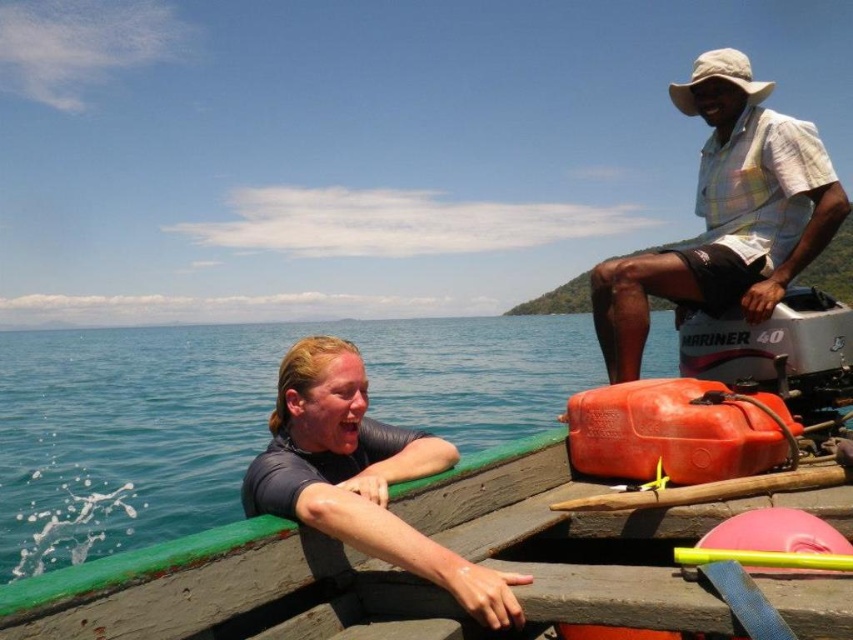
Question: Is the position of white checkered shirt at upper right more distant than that of dark gray wetsuit at left?

Choices:
 (A) no
 (B) yes

Answer: (B)

Question: Which object is positioned closest to the dark gray wetsuit at left?

Choices:
 (A) green wood boat at center
 (B) white checkered shirt at upper right

Answer: (A)

Question: Is white checkered shirt at upper right closer to camera compared to dark gray wetsuit at left?

Choices:
 (A) yes
 (B) no

Answer: (B)

Question: Estimate the real-world distances between objects in this image. Which object is closer to the green wood boat at center?

Choices:
 (A) white checkered shirt at upper right
 (B) dark gray wetsuit at left

Answer: (B)

Question: Which point is closer to the camera taking this photo?

Choices:
 (A) (744, 170)
 (B) (78, 589)

Answer: (B)

Question: Is green wood boat at center closer to camera compared to dark gray wetsuit at left?

Choices:
 (A) no
 (B) yes

Answer: (B)